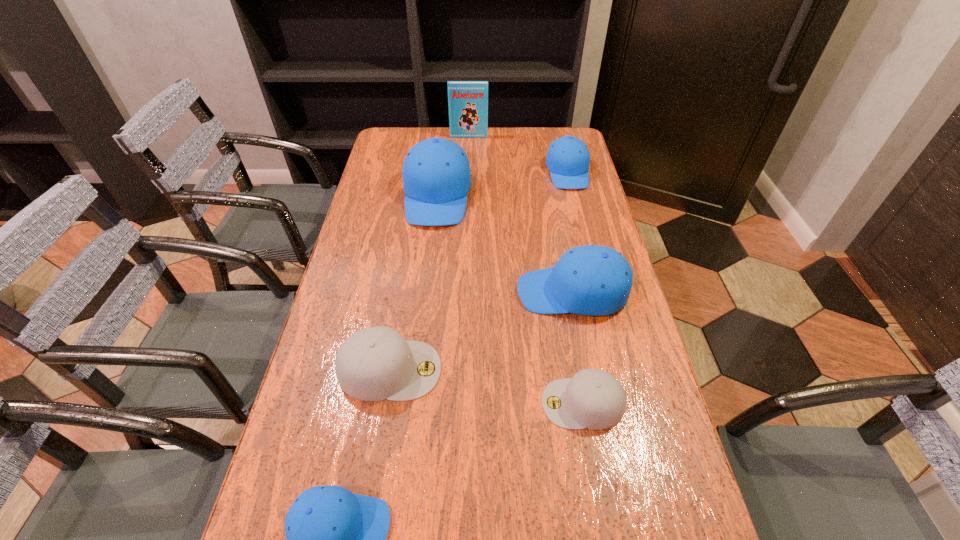
The width and height of the screenshot is (960, 540). What are the coordinates of `book` in the screenshot? It's located at click(467, 100).

I want to click on the tallest object, so click(467, 100).

I want to click on the biggest blue cap, so click(x=436, y=174).

Find the location of `the tallest cap`. the tallest cap is located at coordinates (436, 174).

This screenshot has height=540, width=960. In order to click on the second tallest cap in this screenshot , I will do `click(590, 280)`.

Identify the location of the third smallest blue cap. (590, 280).

In order to click on the second smallest blue cap in this screenshot , I will do `click(568, 158)`.

Identify the location of the bigger gray cap. (376, 363).

I want to click on the smaller gray cap, so click(x=594, y=399).

Image resolution: width=960 pixels, height=540 pixels. I want to click on free point located 0.250m on the front cover of the blue book, so click(x=468, y=172).